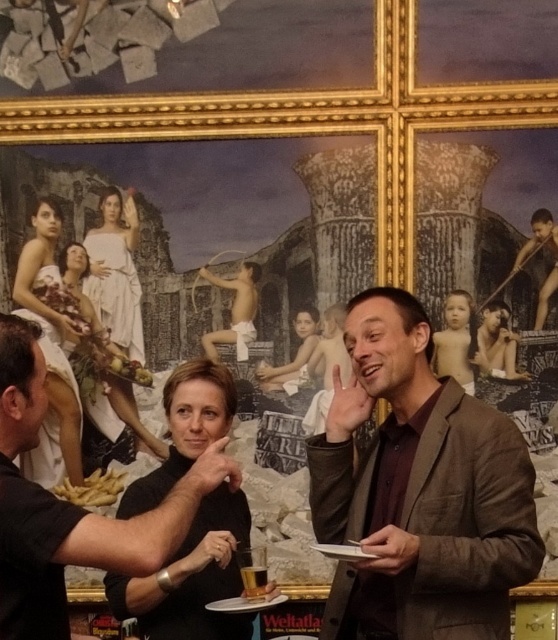
You are standing in front of the large ornate painting and notice two points marked on it. One is at coordinate point (45, 282) and the other at point (138, 336). Which point is closer to you?

Point (45, 282) is further to the camera than point (138, 336), so the point at (138, 336) is closer to you.

You are standing in front of the large ornate painting and notice two points marked on it. The first point is at coordinates point (x=103, y=301) and the second is at point (x=266, y=582). Which point is closer to you?

Point (x=103, y=301) is closer to you because it is further to the viewer than point (x=266, y=582).

You are an artist trying to sketch the scene. You need to decide which object, the white fabric dress at upper left or the white marble statue at upper center, requires more space in your drawing. Based on the description, which one should you allocate more width to?

The white fabric dress at upper left might be wider than the white marble statue at upper center, so you should allocate more width to the white fabric dress at upper left in your drawing.